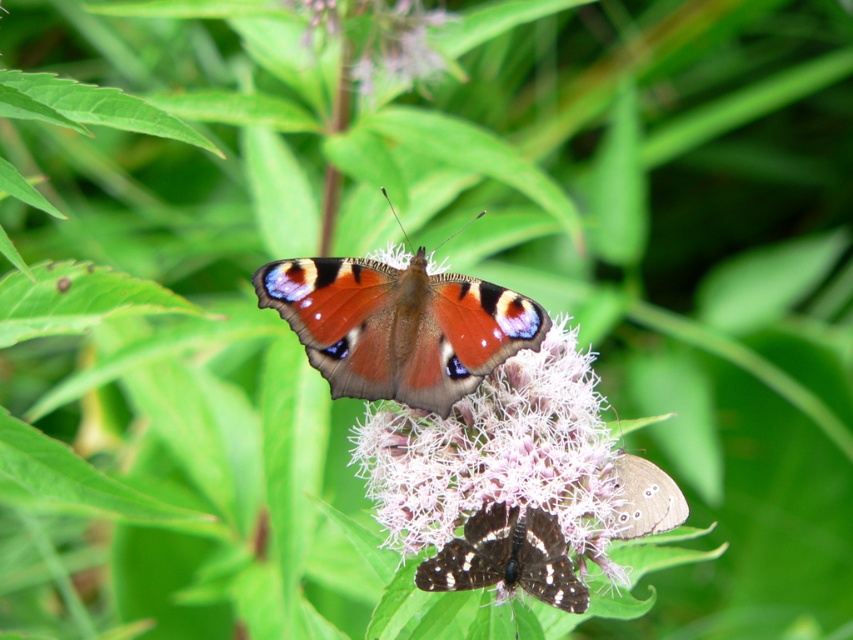
Does point (505, 561) come closer to viewer compared to point (664, 506)?

Yes, point (505, 561) is closer to viewer.

Based on the photo, which of these two, shiny brown butterfly at center or brown speckled butterfly at lower right, stands taller?

shiny brown butterfly at center is taller.

Does point (450, 586) come behind point (672, 497)?

That is False.

Identify the location of shiny brown butterfly at center. The height and width of the screenshot is (640, 853). (508, 557).

Which is more to the right, shiny orange butterfly at center or shiny brown butterfly at center?

Positioned to the right is shiny brown butterfly at center.

Measure the distance between shiny orange butterfly at center and shiny brown butterfly at center.

12.04 inches

Who is more forward, (502, 308) or (543, 532)?

Positioned in front is point (543, 532).

At what (x,y) coordinates should I click in order to perform the action: click on shiny orange butterfly at center. Please return your answer as a coordinate pair (x, y). The width and height of the screenshot is (853, 640). Looking at the image, I should click on (398, 326).

Does pink fluffy flower at center appear over shiny orange butterfly at center?

Incorrect, pink fluffy flower at center is not positioned above shiny orange butterfly at center.

Is pink fluffy flower at center positioned at the back of shiny orange butterfly at center?

Yes, pink fluffy flower at center is behind shiny orange butterfly at center.

The image size is (853, 640). What are the coordinates of `pink fluffy flower at center` in the screenshot? It's located at (498, 454).

Locate an element on the screen. The image size is (853, 640). pink fluffy flower at center is located at coordinates (498, 454).